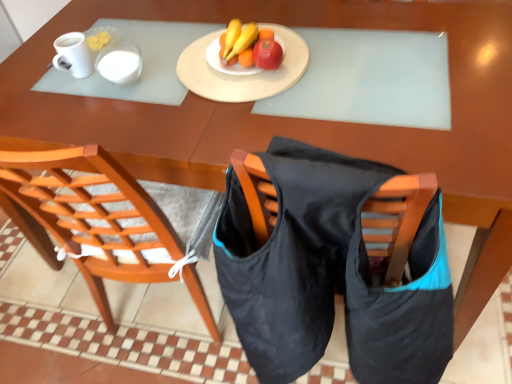
Find the location of a particular element. This screenshot has width=512, height=384. vacant space that is to the left of matte red apple at center is located at coordinates (208, 78).